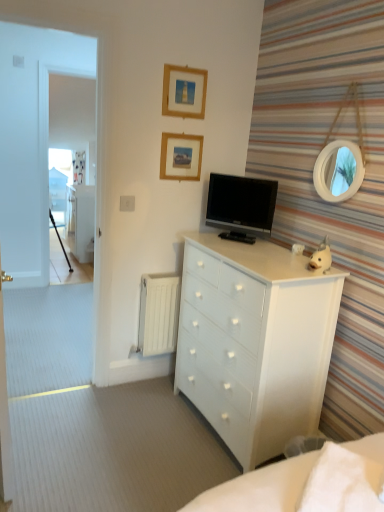
Where is `blank space above transparent glass door at left (from a real-world perspective)`? blank space above transparent glass door at left (from a real-world perspective) is located at coordinates (64, 6).